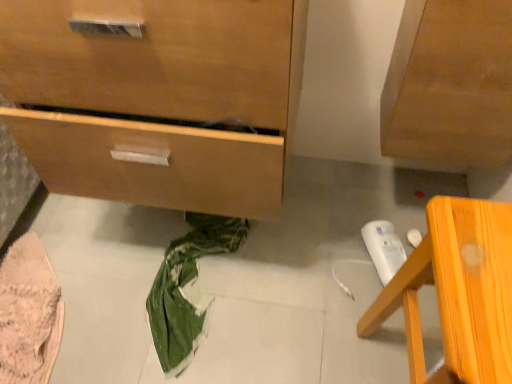
Where is `vacant area situated to the left side of orange wood chair at lower right`? vacant area situated to the left side of orange wood chair at lower right is located at coordinates (310, 343).